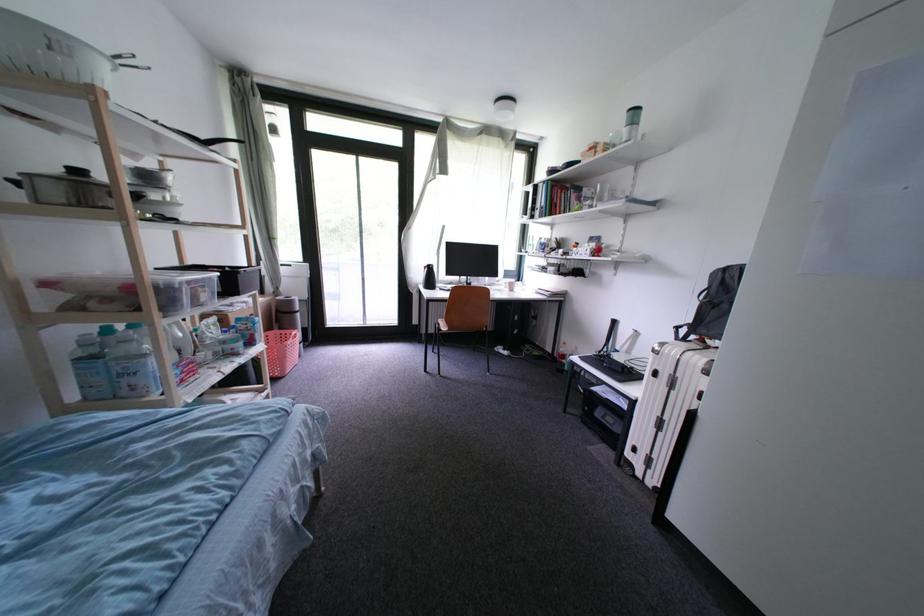
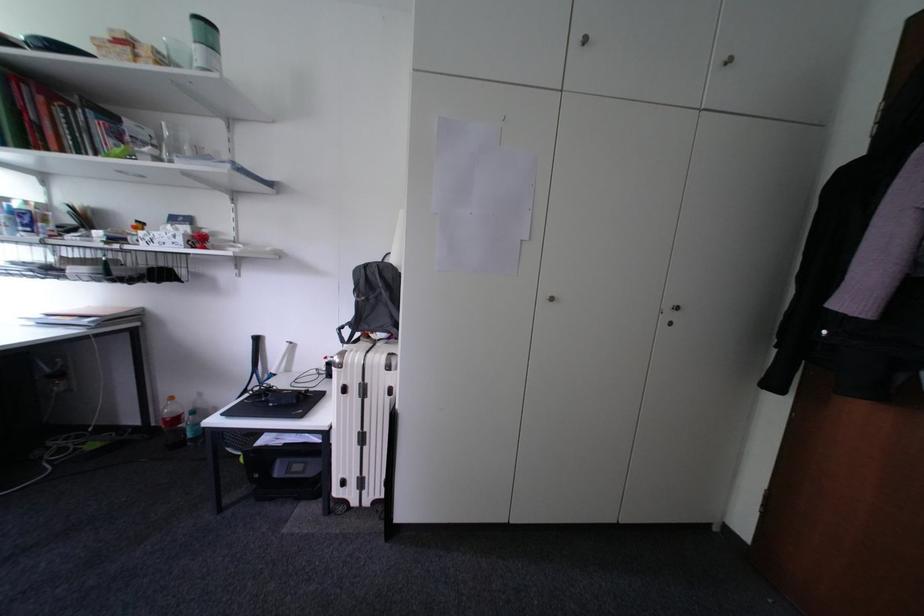
Question: The first image is from the beginning of the video and the second image is from the end. How did the camera likely rotate when shooting the video?

Choices:
 (A) Left
 (B) Right
 (C) Up
 (D) Down

Answer: (B)